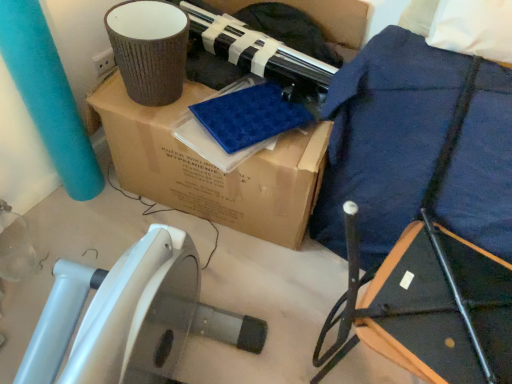
Question: Can you confirm if navy blue fabric at upper right is positioned to the right of brown cardboard box at upper center?

Choices:
 (A) no
 (B) yes

Answer: (B)

Question: Is navy blue fabric at upper right placed right next to brown cardboard box at upper center?

Choices:
 (A) no
 (B) yes

Answer: (A)

Question: Is navy blue fabric at upper right turned away from brown cardboard box at upper center?

Choices:
 (A) no
 (B) yes

Answer: (A)

Question: Is navy blue fabric at upper right at the left side of brown cardboard box at upper center?

Choices:
 (A) no
 (B) yes

Answer: (A)

Question: From the image's perspective, is navy blue fabric at upper right beneath brown cardboard box at upper center?

Choices:
 (A) no
 (B) yes

Answer: (B)

Question: Considering the relative sizes of navy blue fabric at upper right and brown cardboard box at upper center in the image provided, is navy blue fabric at upper right bigger than brown cardboard box at upper center?

Choices:
 (A) no
 (B) yes

Answer: (A)

Question: Can you confirm if brown cardboard box at upper center is positioned to the left of navy blue fabric at upper right?

Choices:
 (A) yes
 (B) no

Answer: (A)

Question: Is brown cardboard box at upper center positioned behind navy blue fabric at upper right?

Choices:
 (A) no
 (B) yes

Answer: (B)

Question: Is brown cardboard box at upper center outside navy blue fabric at upper right?

Choices:
 (A) no
 (B) yes

Answer: (B)

Question: Is brown cardboard box at upper center oriented away from navy blue fabric at upper right?

Choices:
 (A) no
 (B) yes

Answer: (A)

Question: From the image's perspective, is brown cardboard box at upper center on top of navy blue fabric at upper right?

Choices:
 (A) no
 (B) yes

Answer: (B)

Question: Are brown cardboard box at upper center and navy blue fabric at upper right making contact?

Choices:
 (A) no
 (B) yes

Answer: (A)

Question: In terms of size, does brown cardboard box at upper center appear bigger or smaller than navy blue fabric at upper right?

Choices:
 (A) big
 (B) small

Answer: (A)